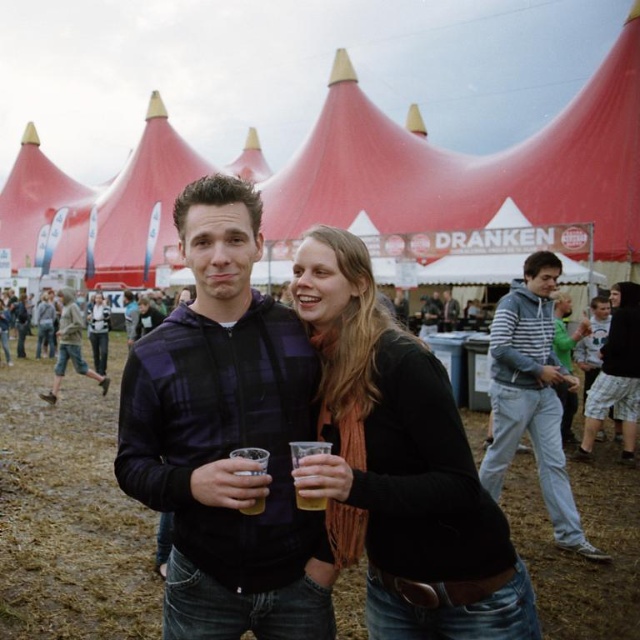
You are a photographer at the festival and want to capture the plaid fabric jacket at center and the black matte scarf at center in a single shot. Can you position yourself so that both items are visible without any overlap?

The plaid fabric jacket at center is above the black matte scarf at center, so yes, you can position yourself to capture both items without overlap by framing the shot to include the space above and below the scarf where the jacket is located.

Based on the photo, what is the object located at the coordinate point (x=472, y=166) in the image?

The object located at the coordinate point (x=472, y=166) is the red fabric tent at center.

Consider the image. You are a festival attendee holding a translucent plastic cup at center. You want to take a photo of the red fabric tent at center without any obstructions. Since the tent is taller than your cup, where should you position your cup relative to the tent in the frame?

Since the red fabric tent at center is taller than the translucent plastic cup at center, you should position the translucent plastic cup at center below the red fabric tent at center in the frame to avoid blocking the view of the tent.